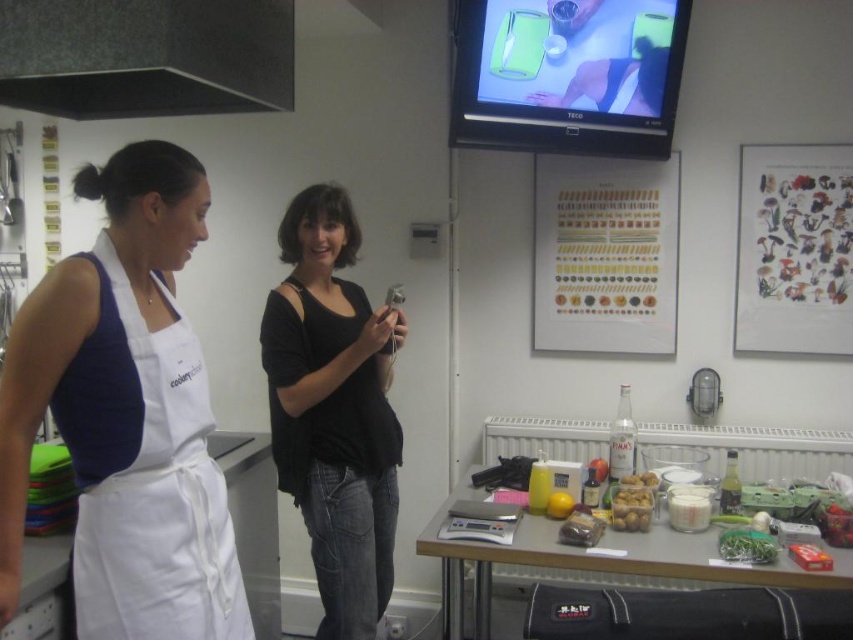
Question: Can you confirm if black matte exhaust hood at upper left is smaller than translucent plastic container at center?

Choices:
 (A) no
 (B) yes

Answer: (A)

Question: Estimate the real-world distances between objects in this image. Which object is closer to the wooden poster at upper center?

Choices:
 (A) white fabric apron at left
 (B) translucent plastic container at center

Answer: (B)

Question: Is black cotton shirt at center positioned in front of black matte exhaust hood at upper left?

Choices:
 (A) no
 (B) yes

Answer: (A)

Question: Which point is closer to the camera?

Choices:
 (A) black matte exhaust hood at upper left
 (B) white fabric apron at left

Answer: (B)

Question: Among these objects, which one is nearest to the camera?

Choices:
 (A) black matte exhaust hood at upper left
 (B) translucent plastic container at center
 (C) wooden poster at upper center

Answer: (A)

Question: In this image, where is white fabric apron at left located relative to black cotton shirt at center?

Choices:
 (A) above
 (B) below

Answer: (A)